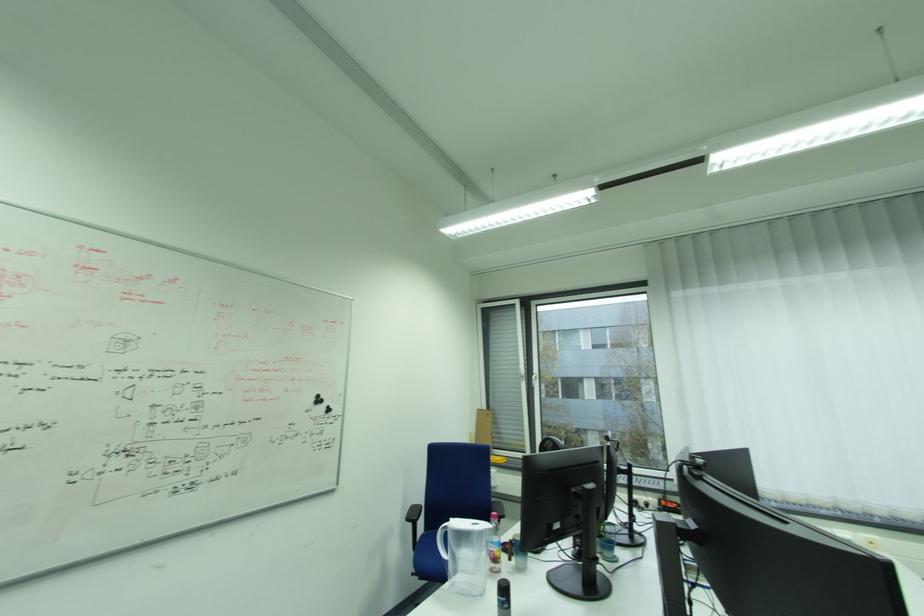
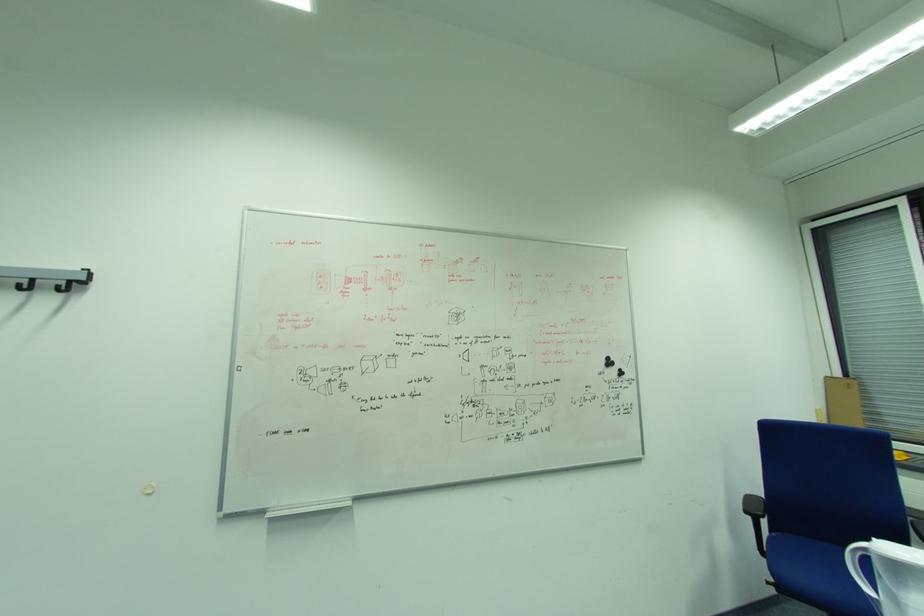
Find the pixel in the second image that matches pixel 420 573 in the first image.

(782, 582)